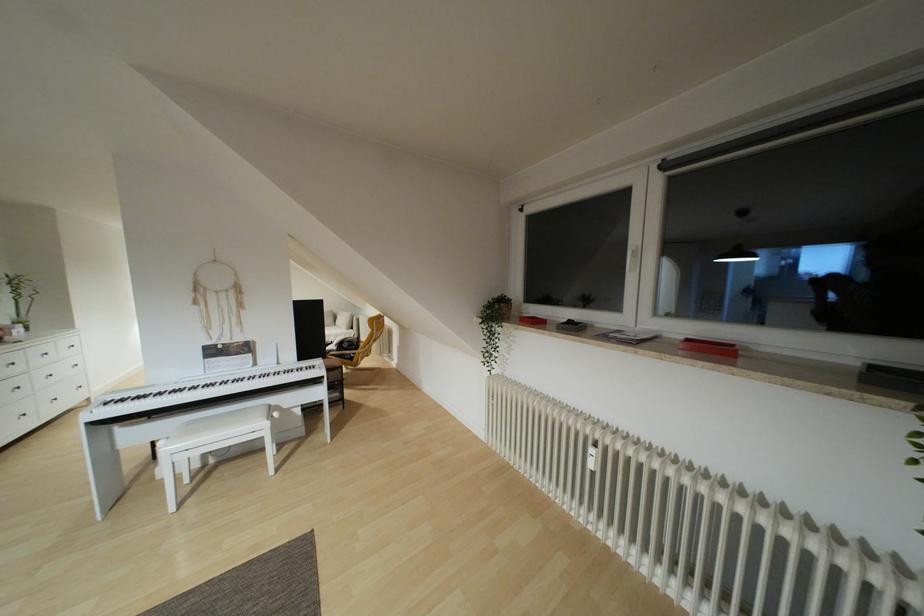
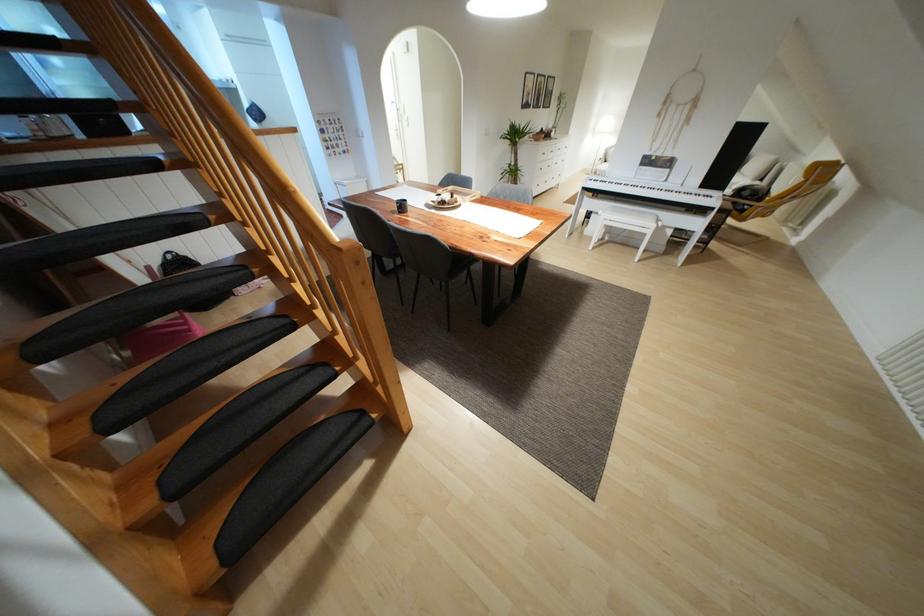
In the second image, find the point that corresponds to point (265, 424) in the first image.

(652, 225)